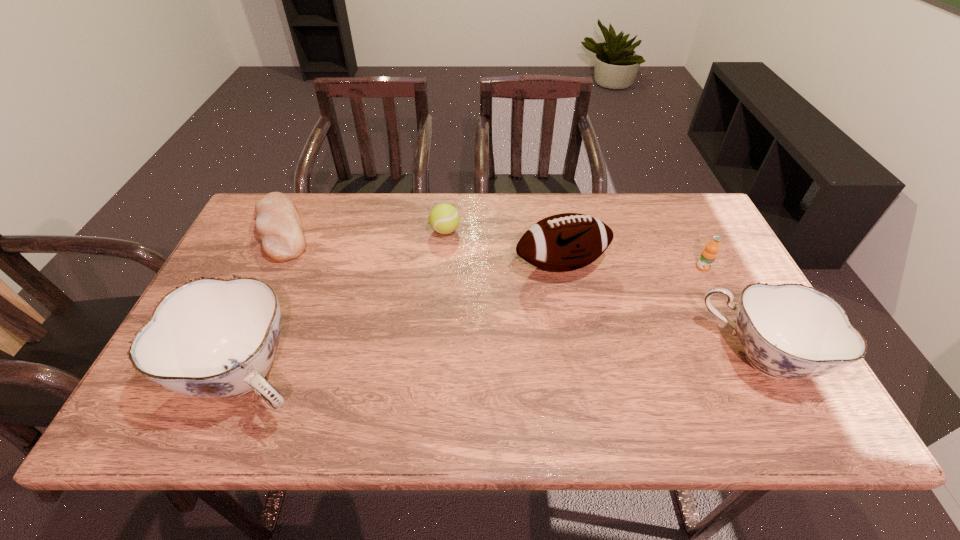
Please mark a free spot for a new chinaware to balance the arrangement. Please provide its 2D coordinates. Your answer should be formatted as a tuple, i.e. [(x, y)], where the tuple contains the x and y coordinates of a point satisfying the conditions above.

[(509, 367)]